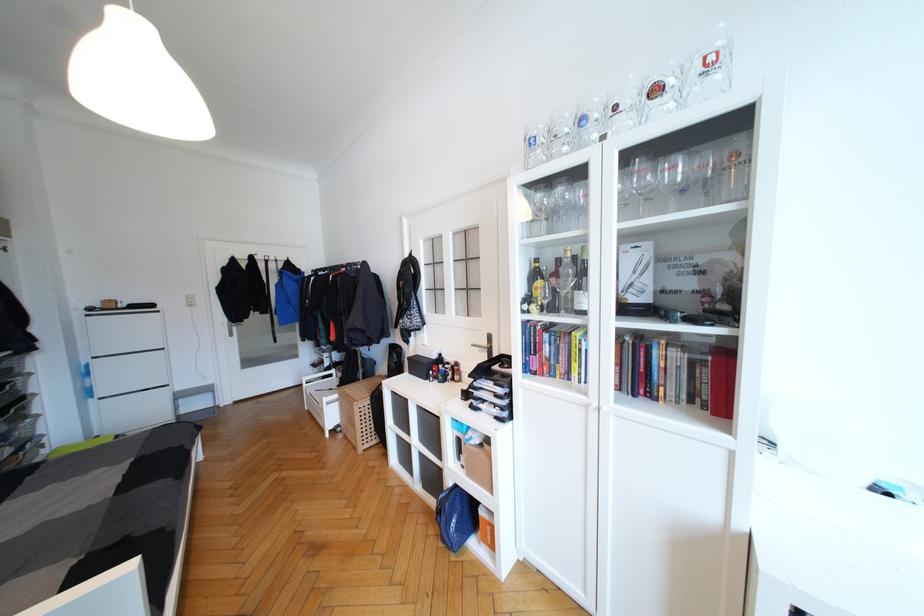
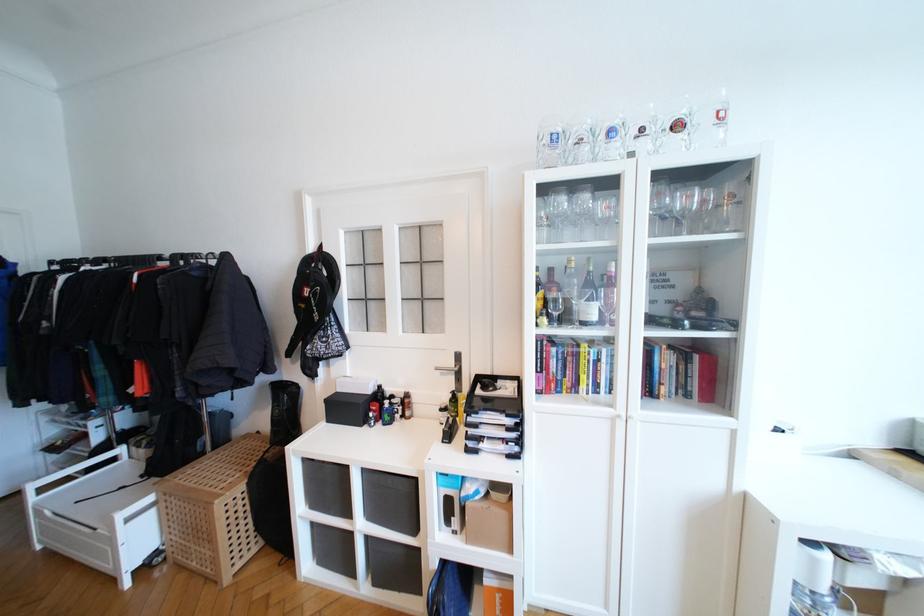
Locate, in the second image, the point that corresponds to the point at 588,124 in the first image.

(616, 136)